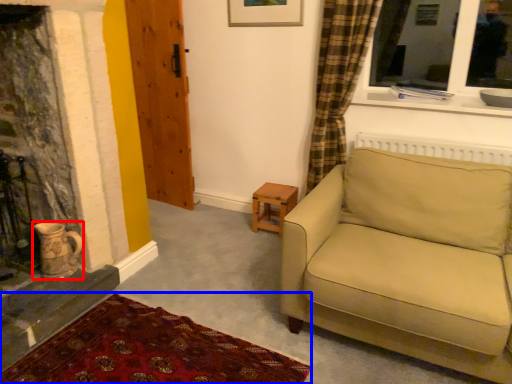
Question: Which object appears closest to the camera in this image, tea pot (highlighted by a red box) or plain (highlighted by a blue box)?

Choices:
 (A) tea pot
 (B) plain

Answer: (B)